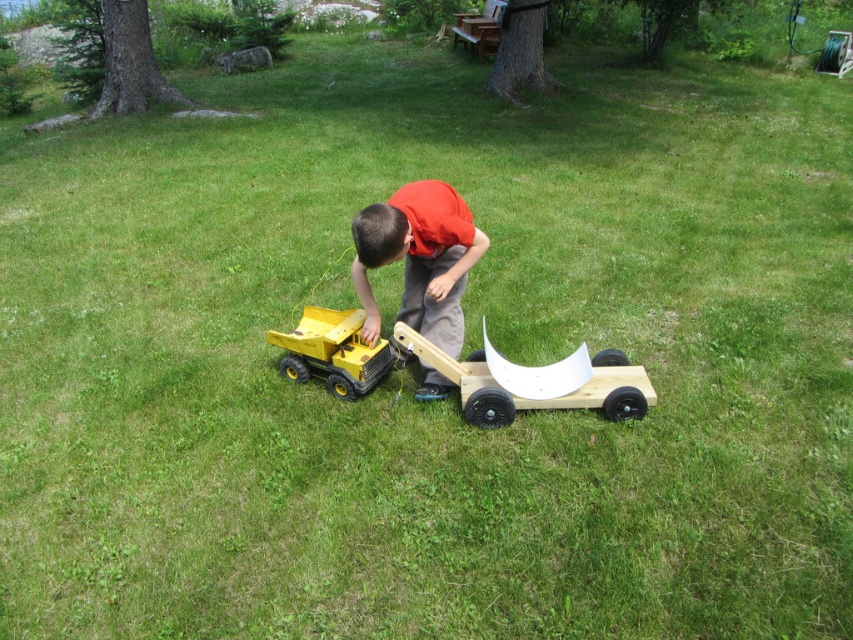
Can you confirm if wooden cart at center is thinner than yellow plastic toy truck at lower center?

Incorrect, wooden cart at center's width is not less than yellow plastic toy truck at lower center's.

Between wooden cart at center and yellow plastic toy truck at lower center, which one appears on the left side from the viewer's perspective?

Positioned to the left is yellow plastic toy truck at lower center.

Image resolution: width=853 pixels, height=640 pixels. Describe the element at coordinates (535, 381) in the screenshot. I see `wooden cart at center` at that location.

The height and width of the screenshot is (640, 853). In order to click on wooden cart at center in this screenshot , I will do `click(535, 381)`.

Can you confirm if orange cotton shirt at center is taller than wooden cart at center?

Correct, orange cotton shirt at center is much taller as wooden cart at center.

Who is more forward, (416, 392) or (492, 408)?

Point (492, 408)

At what (x,y) coordinates should I click in order to perform the action: click on orange cotton shirt at center. Please return your answer as a coordinate pair (x, y). The width and height of the screenshot is (853, 640). Looking at the image, I should click on (419, 259).

Is orange cotton shirt at center to the right of yellow plastic toy truck at lower center from the viewer's perspective?

Correct, you'll find orange cotton shirt at center to the right of yellow plastic toy truck at lower center.

Who is more distant from viewer, (426,296) or (300,340)?

The point (300,340) is more distant.

Who is more forward, (x=486, y=240) or (x=302, y=368)?

Point (x=486, y=240) is more forward.

Where is `orange cotton shirt at center`? The image size is (853, 640). orange cotton shirt at center is located at coordinates (419, 259).